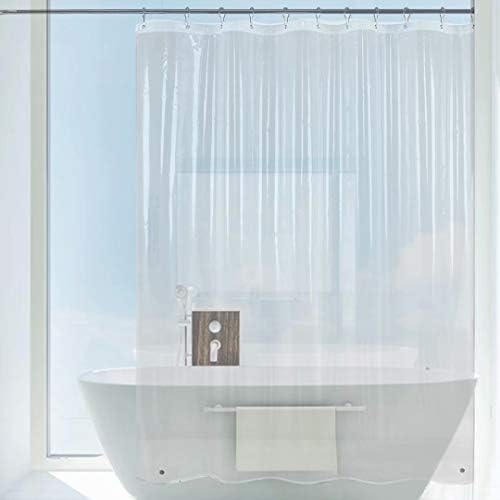
At what (x,y) coordinates should I click in order to perform the action: click on bath. Please return your answer as a coordinate pair (x, y). The width and height of the screenshot is (500, 500). Looking at the image, I should click on (158, 400).